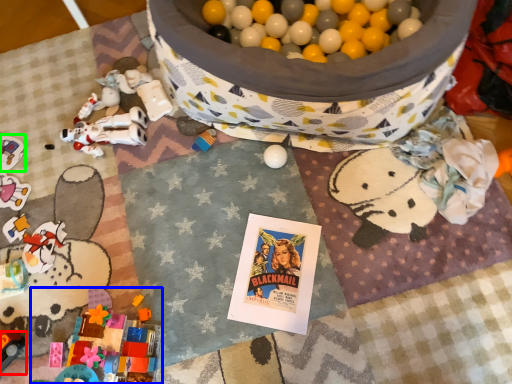
Question: Estimate the real-world distances between objects in this image. Which object is farther from toy (highlighted by a red box), toy (highlighted by a blue box) or toy (highlighted by a green box)?

Choices:
 (A) toy
 (B) toy

Answer: (B)